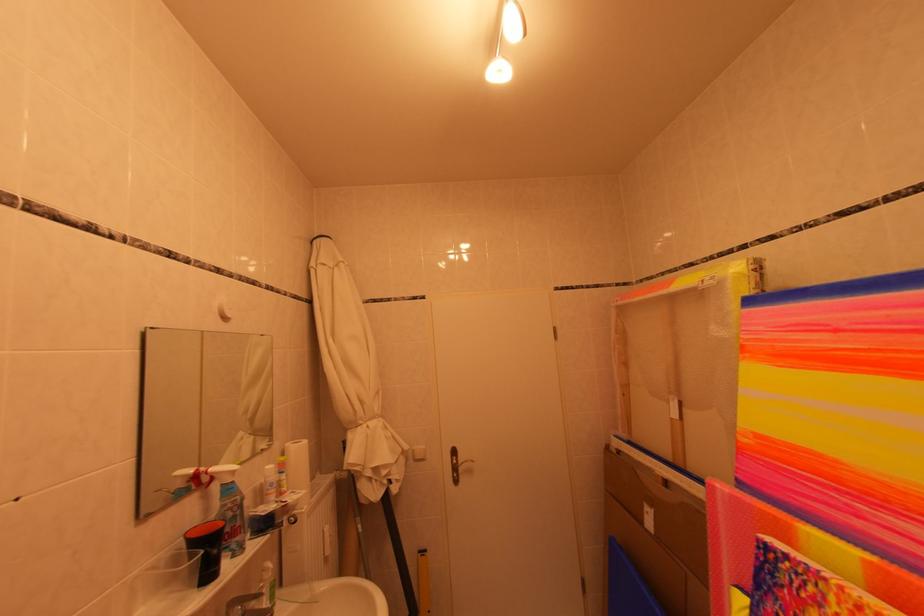
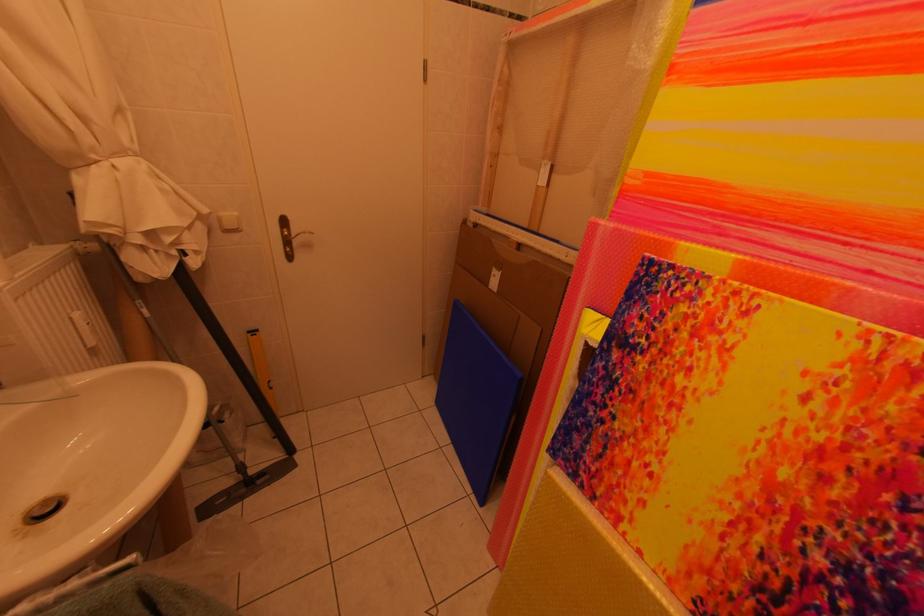
Locate, in the second image, the point that corresponds to (332,535) in the first image.

(79, 321)